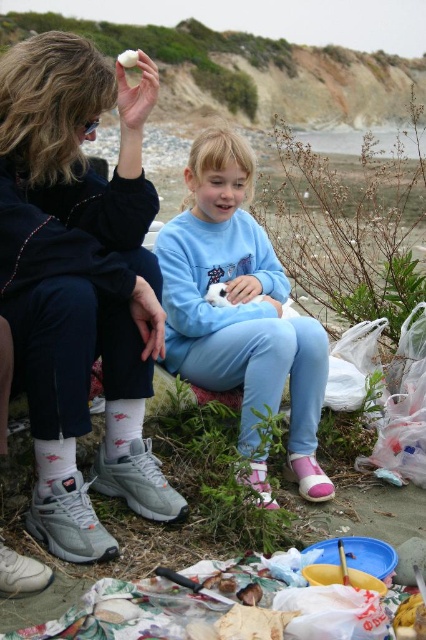
Between white cotton sock at lower left and white fur cat at center, which one is positioned higher?

white fur cat at center is above.

Between point (54, 468) and point (207, 298), which one is positioned in front?

Point (54, 468)

Locate an element on the screen. white cotton sock at lower left is located at coordinates (54, 465).

Who is positioned more to the right, matte black sneakers at left or white fur cat at center?

Positioned to the right is white fur cat at center.

The width and height of the screenshot is (426, 640). I want to click on matte black sneakers at left, so click(74, 230).

Find the location of a particular element. matte black sneakers at left is located at coordinates (74, 230).

Who is more forward, (166, 320) or (213, 291)?

Positioned in front is point (166, 320).

Can you confirm if light blue fleece sweatshirt at center is positioned to the left of white fur cat at center?

Incorrect, light blue fleece sweatshirt at center is not on the left side of white fur cat at center.

Between point (196, 180) and point (222, 300), which one is positioned behind?

Point (196, 180)

You are a GUI agent. You are given a task and a screenshot of the screen. Output one action in this format:
    pyautogui.click(x=<x>, y=<y>)
    Task: Click on the light blue fleece sweatshirt at center
    The height and width of the screenshot is (640, 426).
    Given the screenshot: What is the action you would take?
    pyautogui.click(x=239, y=307)